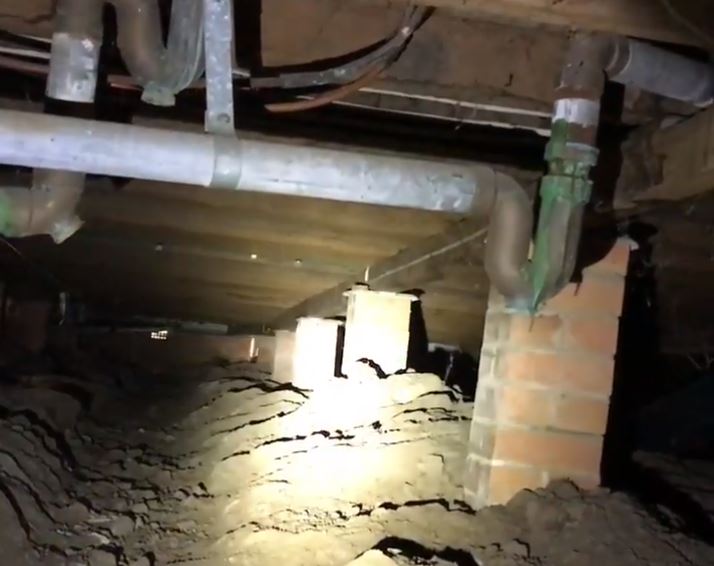
You are a GUI agent. You are given a task and a screenshot of the screen. Output one action in this format:
    pyautogui.click(x=<x>, y=<y>)
    Task: Click on the foundation wall
    
    Given the screenshot: What is the action you would take?
    pyautogui.click(x=200, y=351)